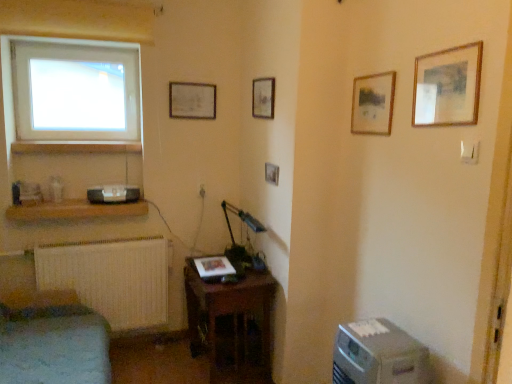
Where is `vacant area on top of transparent glass window at upper left (from a real-world perspective)`? vacant area on top of transparent glass window at upper left (from a real-world perspective) is located at coordinates (78, 48).